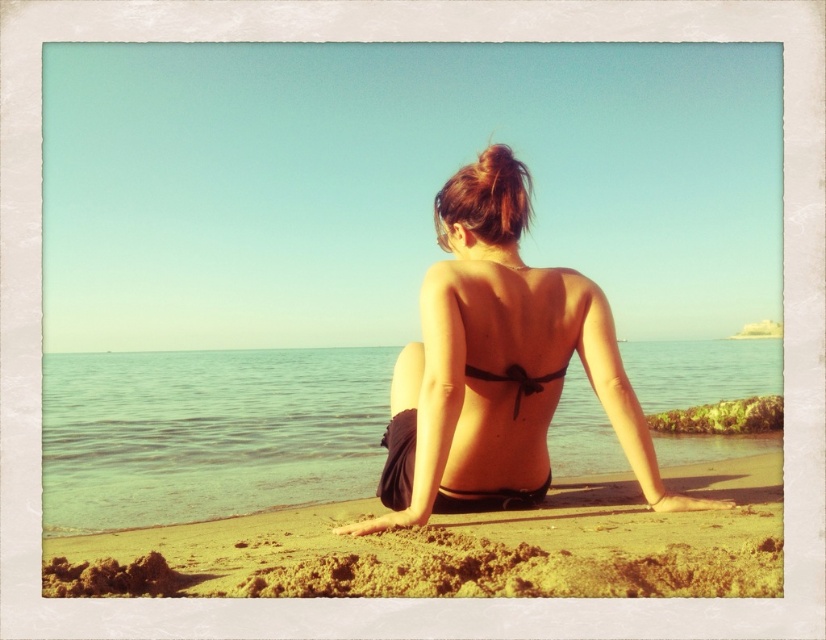
You are a photographer trying to capture a shot of the clear water at center and the black satin bikini top at center. You want to ensure both are in focus. Given that your camera has a depth of field range of 20 feet, will both objects be in focus simultaneously?

The clear water at center is 25.96 feet away from the black satin bikini top at center. Since the distance between them exceeds the camera depth of field range of 20 feet, both objects cannot be in focus simultaneously.

You are a photographer standing on the beach and want to capture the clear water at center at point (x=207, y=433). Which direction should you face to ensure it is in the center of your photo?

The clear water at center is located at point (x=207, y=433), so you should face directly towards that point to center it in your photo.

You are a photographer trying to capture the black satin bikini top at center and the clear water at center in one shot. Which object is closer to the camera?

The black satin bikini top at center is closer to the camera because the clear water at center is further away.